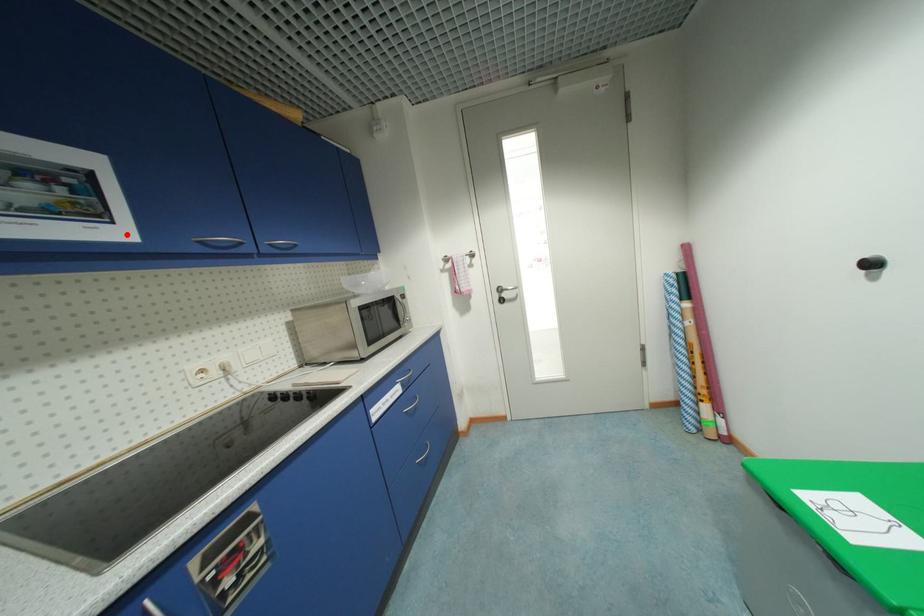
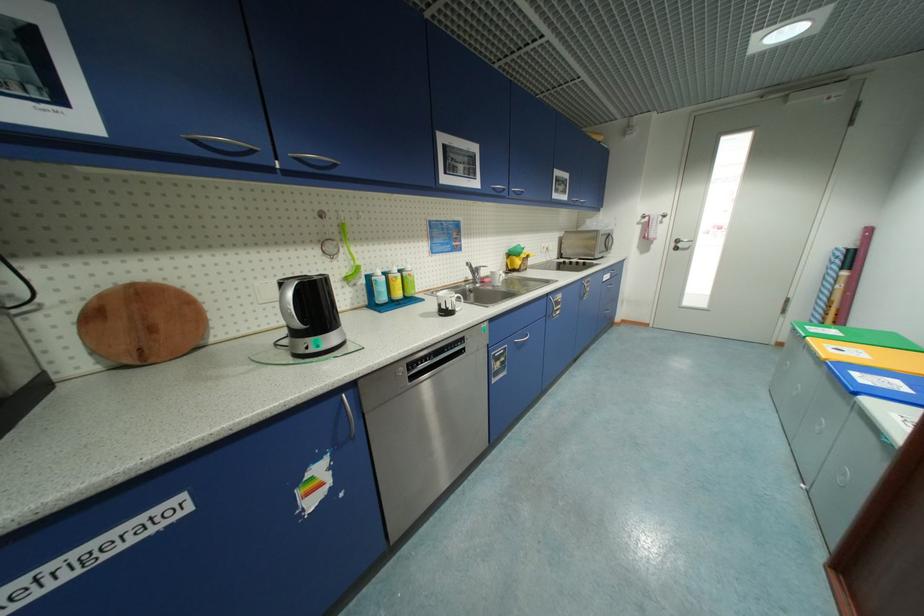
Question: I am providing you with two images of the same scene from different viewpoints. Image1 has a red point marked. In image2, the corresponding 3D location appears at what relative position? Reply with the corresponding letter.

Choices:
 (A) Closer
 (B) Farther

Answer: (A)